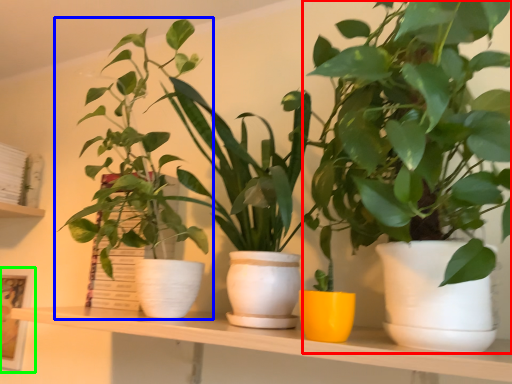
Question: Which is nearer to the houseplant (highlighted by a red box)? houseplant (highlighted by a blue box) or picture frame (highlighted by a green box).

Choices:
 (A) houseplant
 (B) picture frame

Answer: (A)